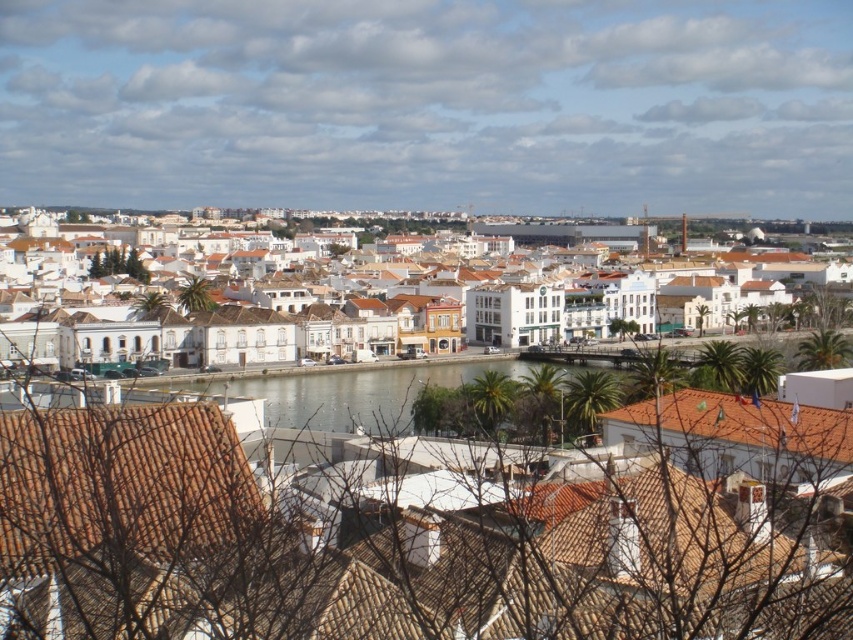
Can you confirm if brown tile roof at lower left is wider than brown tile roof at lower right?

No.

Between brown tile roof at lower left and brown tile roof at lower right, which one is positioned higher?

brown tile roof at lower right is higher up.

Is point (115, 508) closer to viewer compared to point (753, 428)?

Yes, it is.

This screenshot has height=640, width=853. I want to click on brown tile roof at lower left, so click(120, 483).

Between point (149, 317) and point (106, 410), which one is positioned behind?

Positioned behind is point (149, 317).

Can you confirm if white stucco buildings at center is positioned above brown tile roof at lower left?

Yes.

You are a GUI agent. You are given a task and a screenshot of the screen. Output one action in this format:
    pyautogui.click(x=<x>, y=<y>)
    Task: Click on the white stucco buildings at center
    The width and height of the screenshot is (853, 640).
    Given the screenshot: What is the action you would take?
    pyautogui.click(x=308, y=330)

This screenshot has height=640, width=853. I want to click on white stucco buildings at center, so click(308, 330).

Who is positioned more to the left, white stucco buildings at center or brown tile roof at lower right?

Positioned to the left is white stucco buildings at center.

Between white stucco buildings at center and brown tile roof at lower right, which one is positioned lower?

brown tile roof at lower right

You are a GUI agent. You are given a task and a screenshot of the screen. Output one action in this format:
    pyautogui.click(x=<x>, y=<y>)
    Task: Click on the white stucco buildings at center
    
    Given the screenshot: What is the action you would take?
    pyautogui.click(x=308, y=330)